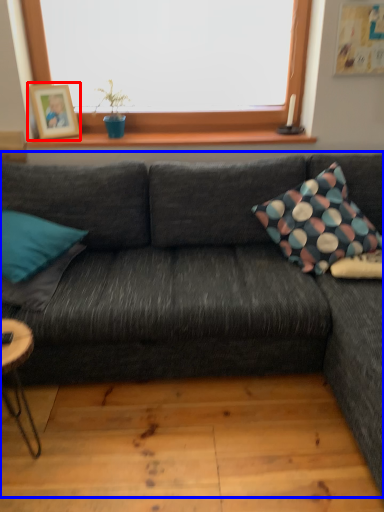
Question: Which object is closer to the camera taking this photo, picture frame (highlighted by a red box) or studio couch (highlighted by a blue box)?

Choices:
 (A) picture frame
 (B) studio couch

Answer: (B)